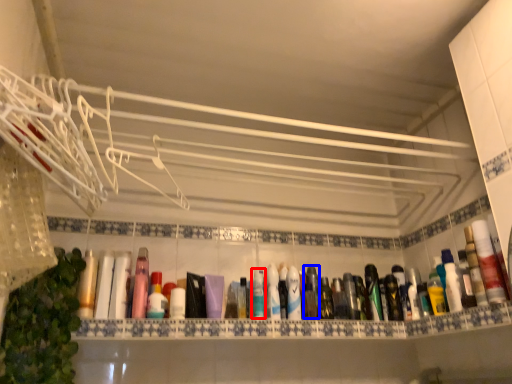
Question: Which point is further to the camera, mouthwash (highlighted by a red box) or mouthwash (highlighted by a blue box)?

Choices:
 (A) mouthwash
 (B) mouthwash

Answer: (B)